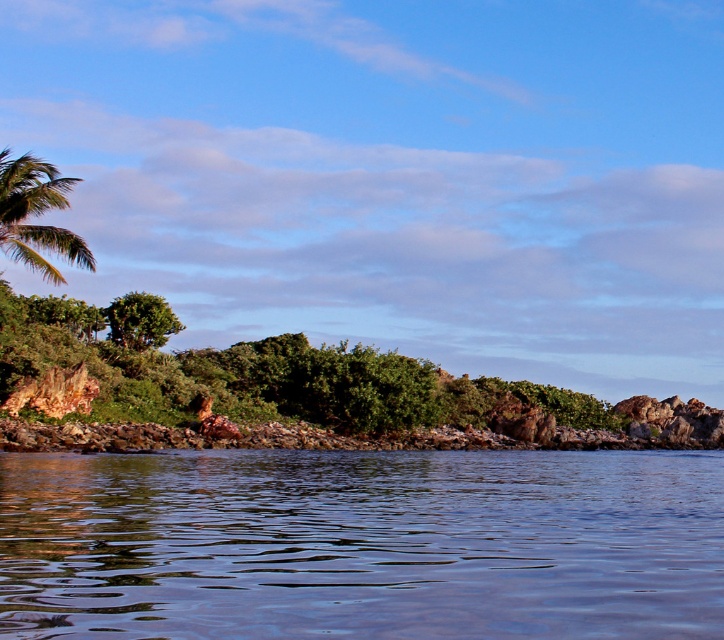
Is transparent water at center thinner than green leafy palm tree at upper left?

Correct, transparent water at center's width is less than green leafy palm tree at upper left's.

Is transparent water at center bigger than green leafy palm tree at upper left?

Actually, transparent water at center might be smaller than green leafy palm tree at upper left.

What are the coordinates of `transparent water at center` in the screenshot? It's located at (362, 544).

Where is `transparent water at center`? This screenshot has width=724, height=640. transparent water at center is located at coordinates (362, 544).